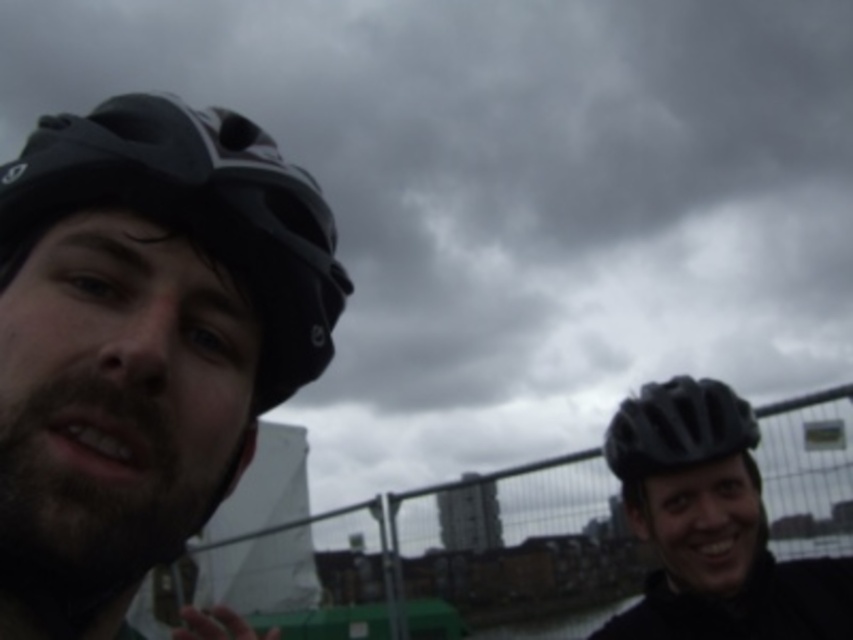
Question: Which object is positioned closest to the matte black helmet at center?

Choices:
 (A) matte black helmet at left
 (B) matte black helmet at right

Answer: (B)

Question: Which object is positioned farthest from the matte black helmet at right?

Choices:
 (A) matte black helmet at left
 (B) matte black helmet at center

Answer: (A)

Question: Where is matte black helmet at left located in relation to matte black helmet at right in the image?

Choices:
 (A) right
 (B) left

Answer: (B)

Question: Does matte black helmet at left have a lesser width compared to matte black helmet at center?

Choices:
 (A) no
 (B) yes

Answer: (B)

Question: Does matte black helmet at left appear on the right side of matte black helmet at center?

Choices:
 (A) yes
 (B) no

Answer: (B)

Question: Which of these objects is positioned farthest from the matte black helmet at right?

Choices:
 (A) matte black helmet at center
 (B) matte black helmet at left

Answer: (B)